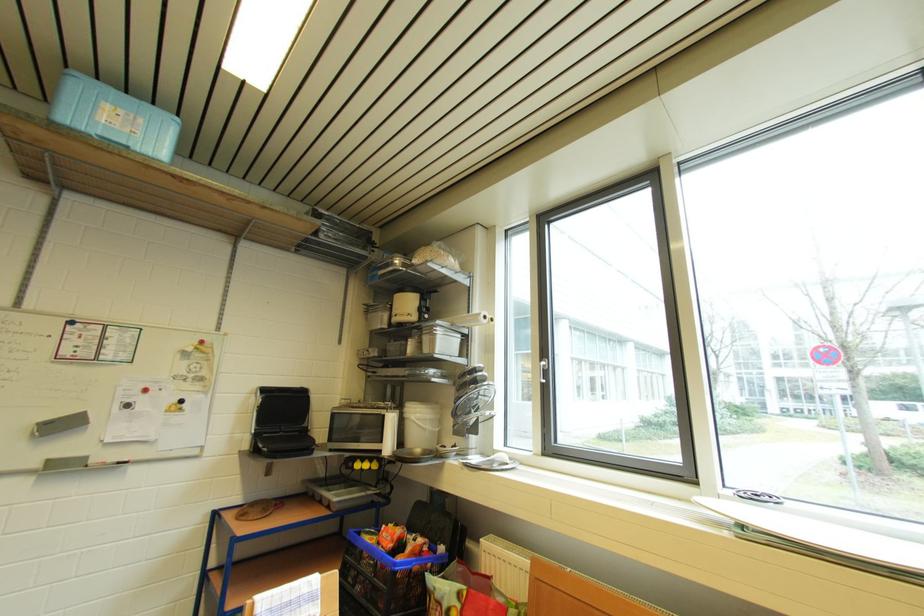
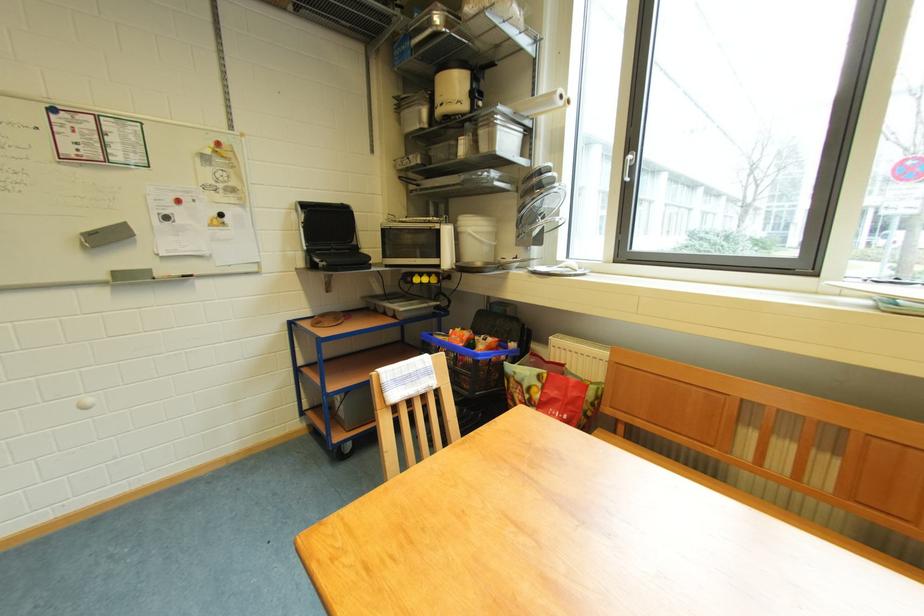
Where in the second image is the point corresponding to (x=484, y=323) from the first image?

(560, 103)